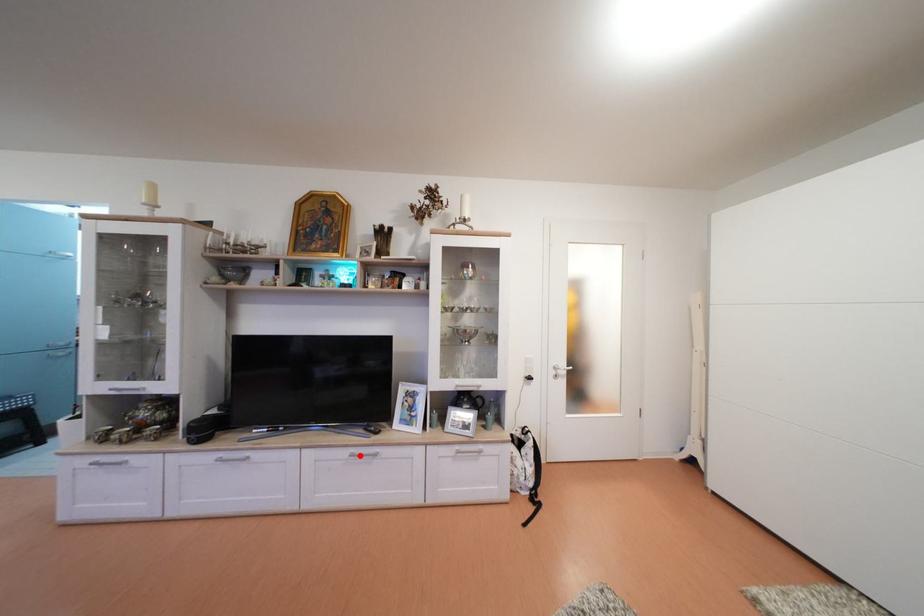
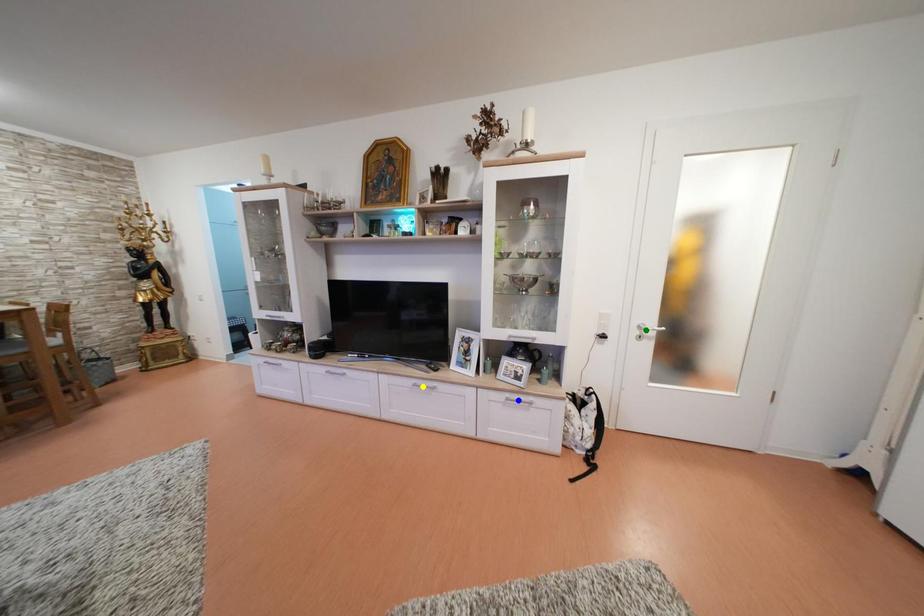
Question: I am providing you with two images of the same scene from different viewpoints. A red point is marked on the first image. You are given multiple points on the second image. Which spot in image 2 lines up with the point in image 1?

Choices:
 (A) blue point
 (B) green point
 (C) yellow point

Answer: (C)